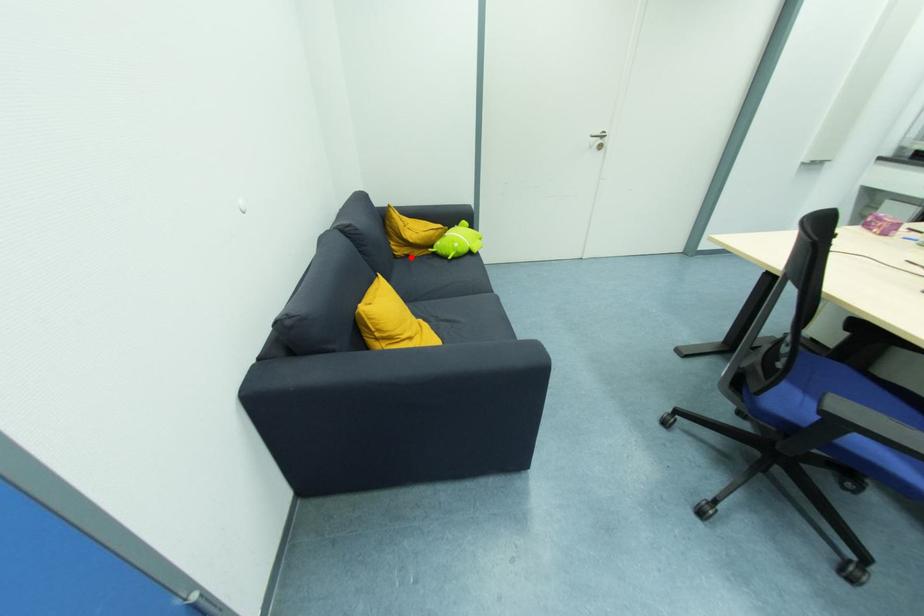
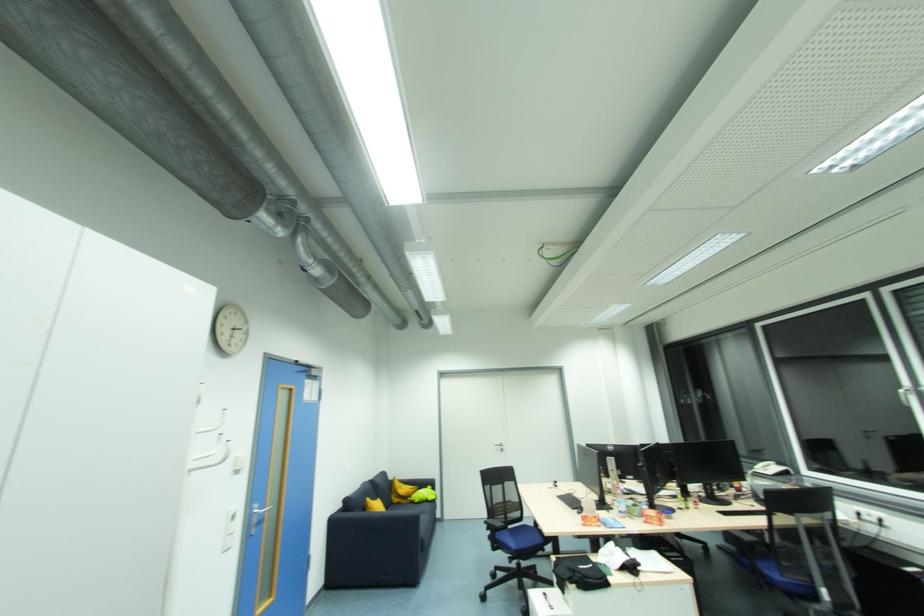
Find the pixel in the second image that matches the highlighted location in the first image.

(400, 505)